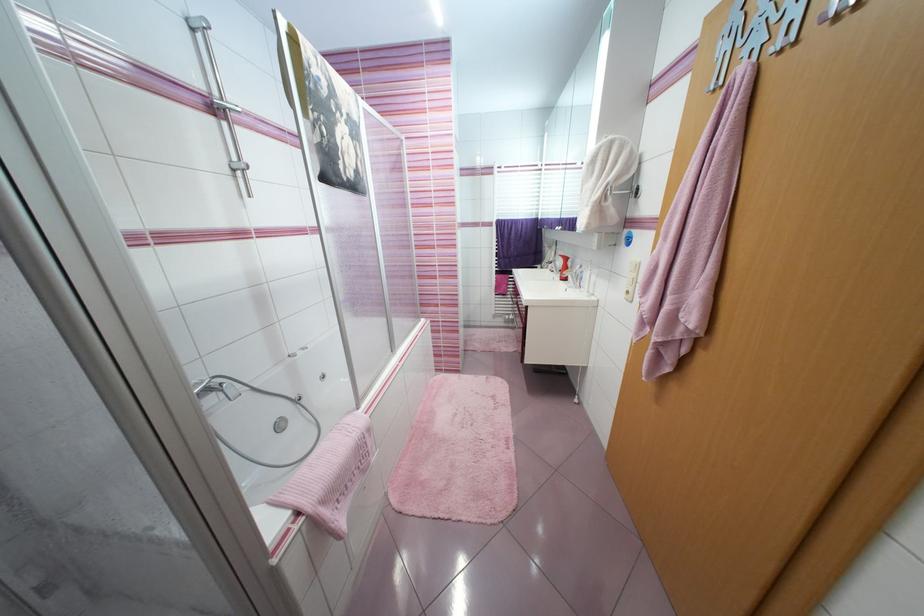
Image resolution: width=924 pixels, height=616 pixels. What do you see at coordinates (241, 172) in the screenshot?
I see `the shower holder knob` at bounding box center [241, 172].